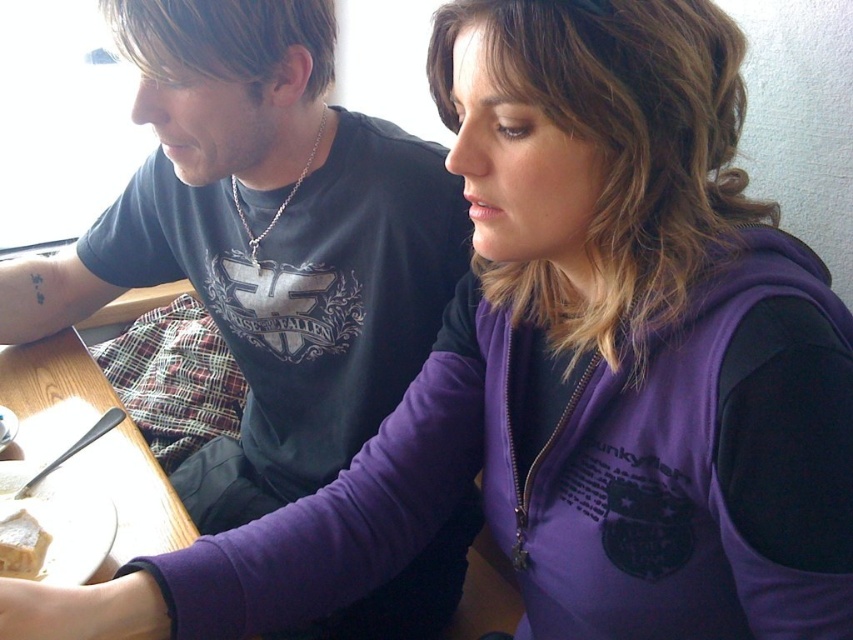
You are a photographer setting up a shot of the matte black shirt at upper left and the wooden table at lower left. You need to ensure that the distance between them in the photo matches their actual distance. What is the minimum distance you should keep between these two objects in your composition?

The minimum distance you should keep between the matte black shirt at upper left and the wooden table at lower left in your composition is 10.49 inches, as this is their actual distance according to the description.